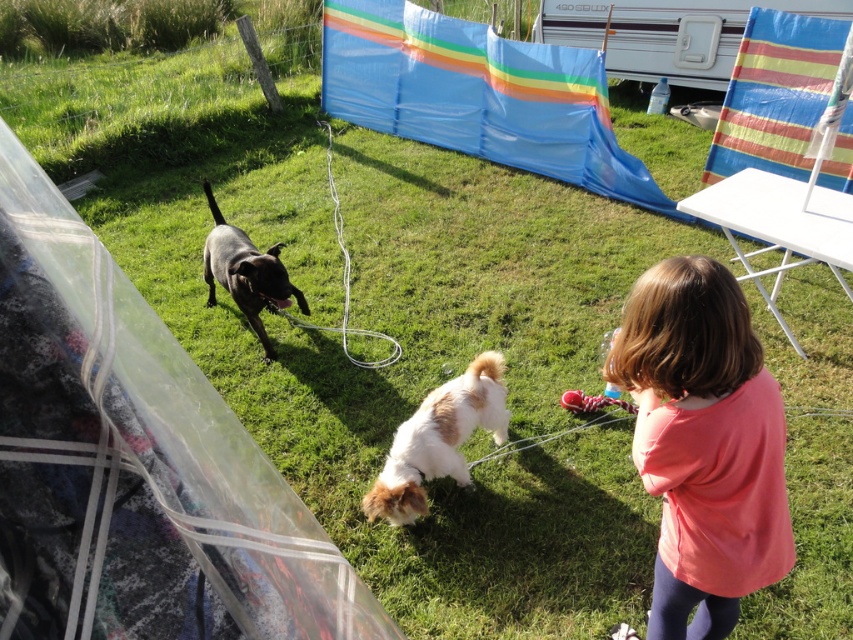
Question: Estimate the real-world distances between objects in this image. Which object is farther from the pink cotton shirt at lower right?

Choices:
 (A) brown and white fur at center
 (B) shiny black dog at center

Answer: (B)

Question: Does pink cotton shirt at lower right appear on the right side of shiny black dog at center?

Choices:
 (A) yes
 (B) no

Answer: (A)

Question: Is brown and white fur at center above shiny black dog at center?

Choices:
 (A) yes
 (B) no

Answer: (B)

Question: Which of the following is the farthest from the observer?

Choices:
 (A) shiny black dog at center
 (B) brown and white fur at center

Answer: (A)

Question: Does pink cotton shirt at lower right have a larger size compared to brown and white fur at center?

Choices:
 (A) no
 (B) yes

Answer: (B)

Question: Among these points, which one is nearest to the camera?

Choices:
 (A) (714, 534)
 (B) (244, 280)

Answer: (A)